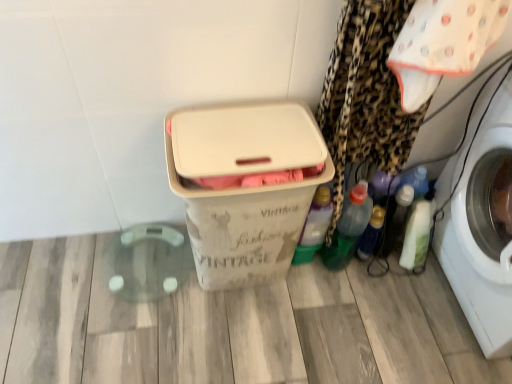
You are a GUI agent. You are given a task and a screenshot of the screen. Output one action in this format:
    pyautogui.click(x=<x>, y=<y>)
    Task: Click on the free location in front of beige plastic storage box at center
    The image size is (512, 384).
    Given the screenshot: What is the action you would take?
    pyautogui.click(x=231, y=343)